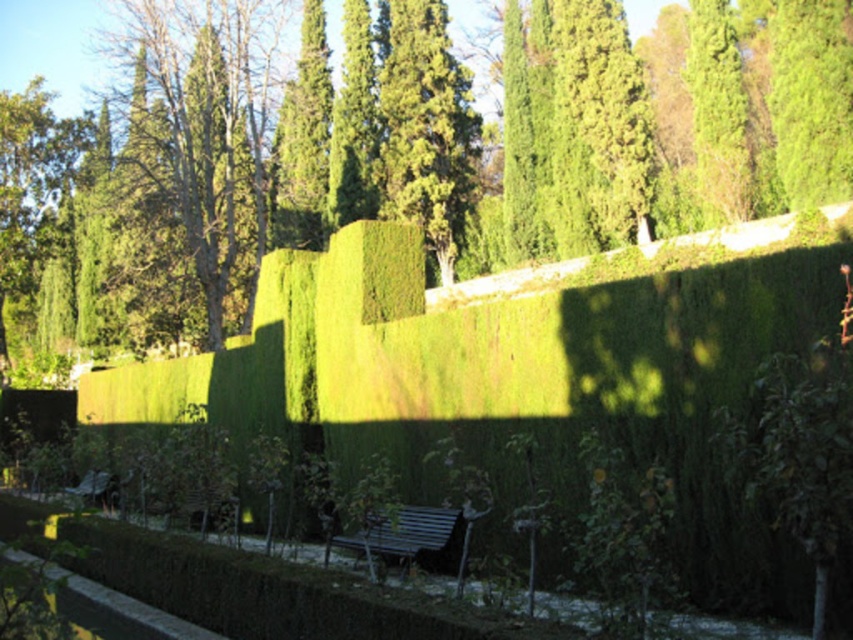
You are planning to place a 10 meter long sculpture between the metallic blue bench at center and the wooden park bench at lower left. Based on the scene, will the sculpture fit in the space between them?

The distance between the metallic blue bench at center and the wooden park bench at lower left is 9.32 meters. Since the sculpture is 10 meters long, it will not fit in the space between them as the available space is shorter than the sculpture.

You are standing at the entrance of the garden and see the green leafy tree at center and the metallic blue bench at center. Which object is closer to you?

The green leafy tree at center is closer to you than the metallic blue bench at center because it is positioned further to the viewer.

You are planning to place a new bench in the garden. The existing metallic blue bench at center is narrower than the green leafy tree at center. If you want to keep the same spacing between the new bench and the tree as the existing one, should the new bench be wider or narrower than the existing one?

The green leafy tree at center is wider than the metallic blue bench at center. To maintain the same spacing between the new bench and the tree, the new bench should be wider than the existing one so that the distance remains consistent with the tree.